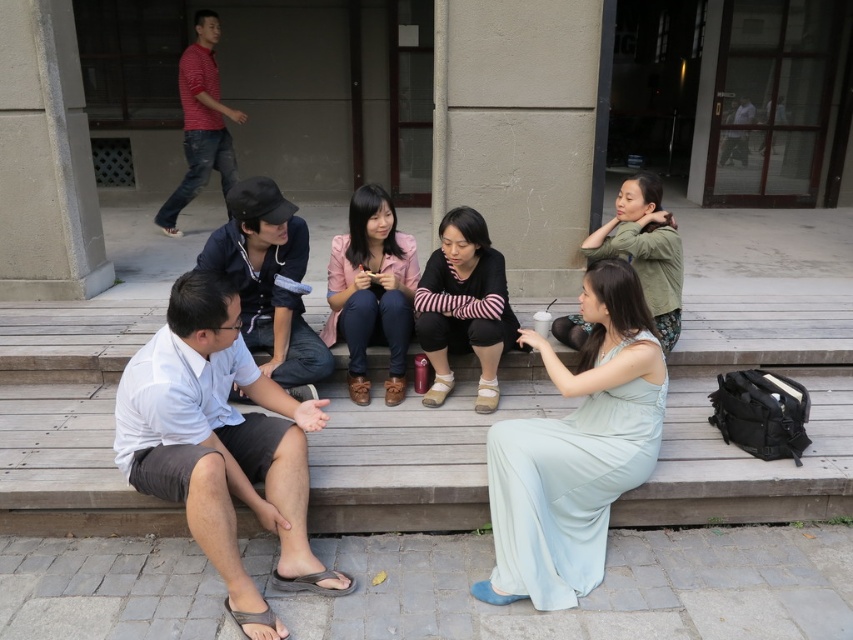
Question: Can you confirm if light blue silk dress at lower right is positioned below black striped sweater at center?

Choices:
 (A) no
 (B) yes

Answer: (B)

Question: Which object is positioned closest to the pink matte jacket at center?

Choices:
 (A) light blue silk dress at lower right
 (B) black striped sweater at center

Answer: (B)

Question: Which point appears farthest from the camera in this image?

Choices:
 (A) (604, 324)
 (B) (433, 358)

Answer: (B)

Question: Is light blue silk dress at lower right closer to camera compared to pink matte jacket at center?

Choices:
 (A) yes
 (B) no

Answer: (A)

Question: Considering the relative positions of pink matte jacket at center and black striped sweater at center in the image provided, where is pink matte jacket at center located with respect to black striped sweater at center?

Choices:
 (A) above
 (B) below

Answer: (A)

Question: Which of the following is the closest to the observer?

Choices:
 (A) (364, 352)
 (B) (657, 374)
 (C) (637, 244)
 (D) (424, 282)

Answer: (B)